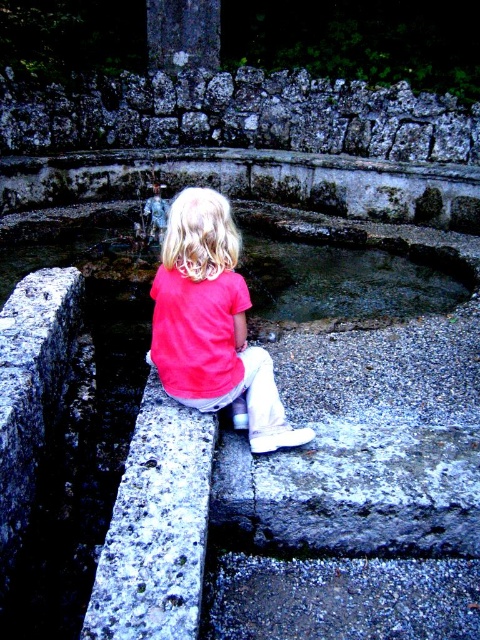
I want to click on pink matte shirt at center, so click(213, 324).

What do you see at coordinates (213, 324) in the screenshot? I see `pink matte shirt at center` at bounding box center [213, 324].

Between point (194, 193) and point (400, 227), which one is positioned behind?

Point (400, 227)

This screenshot has height=640, width=480. What are the coordinates of `pink matte shirt at center` in the screenshot? It's located at pos(213,324).

Who is taller, rough stone wall at upper center or pink matte shirt at center?

rough stone wall at upper center is taller.

Does point (123, 88) lie behind point (232, 221)?

Yes, it is.

Where is `rough stone wall at upper center`? rough stone wall at upper center is located at coordinates (239, 115).

From the picture: Between rough stone wall at upper center and smooth stone water at center, which one is positioned higher?

rough stone wall at upper center is higher up.

Is rough stone wall at upper center smaller than smooth stone water at center?

Actually, rough stone wall at upper center might be larger than smooth stone water at center.

Is point (394, 116) more distant than point (450, 257)?

That is True.

Where is `rough stone wall at upper center`? rough stone wall at upper center is located at coordinates (239, 115).